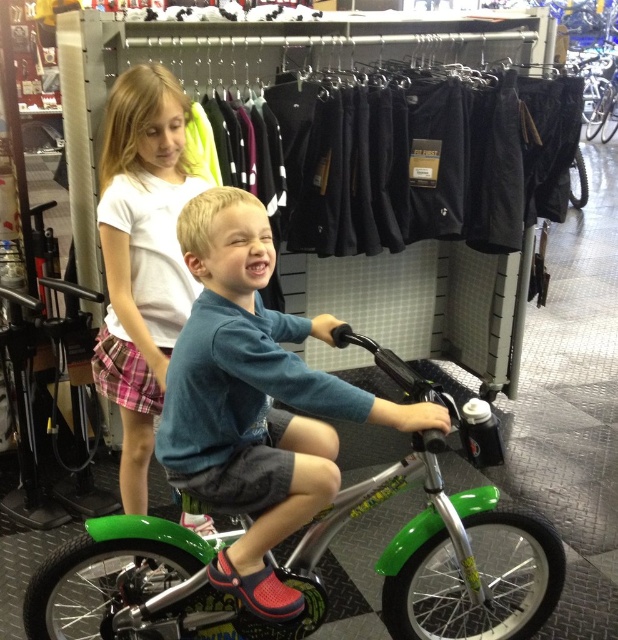
You are a customer in the bike shop and want to buy a bicycle for your child. You see two bicycles at the center of the image, a green plastic bicycle at center and a green metallic bicycle at center. Which one is positioned more to the right side?

The green plastic bicycle at center is positioned more to the right side than the green metallic bicycle at center.